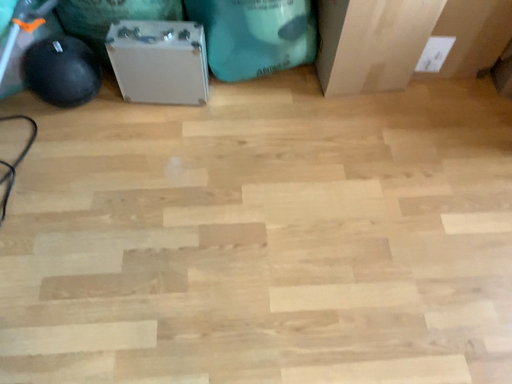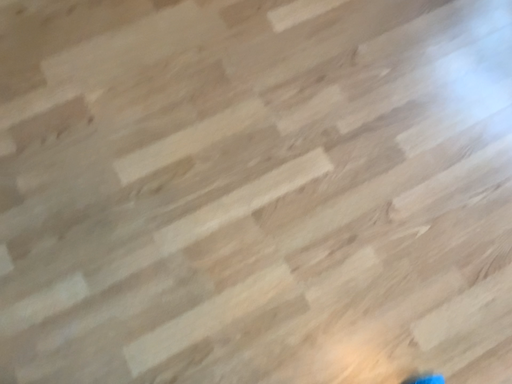
Question: Which way did the camera rotate in the video?

Choices:
 (A) rotated upward
 (B) rotated downward

Answer: (B)